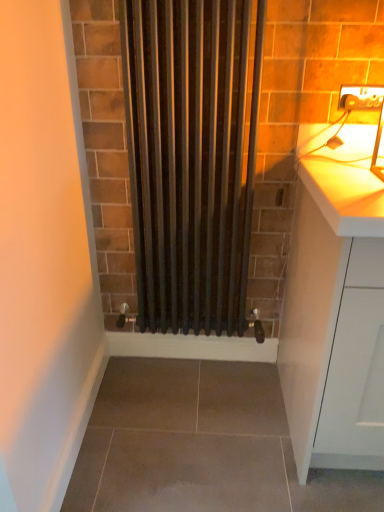
What is the approximate height of white matte cabinet at right?

The height of white matte cabinet at right is 37.88 inches.

The height and width of the screenshot is (512, 384). Describe the element at coordinates (360, 97) in the screenshot. I see `matte white electric outlet at upper right` at that location.

Locate an element on the screen. matte white electric outlet at upper right is located at coordinates (360, 97).

The image size is (384, 512). What are the coordinates of `black matte radiator at center` in the screenshot? It's located at (191, 159).

Is matte white electric outlet at upper right shorter than white matte cabinet at right?

Indeed, matte white electric outlet at upper right has a lesser height compared to white matte cabinet at right.

Is matte white electric outlet at upper right in front of or behind white matte cabinet at right in the image?

In the image, matte white electric outlet at upper right appears behind white matte cabinet at right.

Is point (369, 95) farther from viewer compared to point (298, 342)?

That is False.

In the scene shown: Considering the relative sizes of matte white electric outlet at upper right and white matte cabinet at right in the image provided, is matte white electric outlet at upper right smaller than white matte cabinet at right?

Correct, matte white electric outlet at upper right occupies less space than white matte cabinet at right.

You are a GUI agent. You are given a task and a screenshot of the screen. Output one action in this format:
    pyautogui.click(x=<x>, y=<y>)
    Task: Click on the electric outlet on the left of white matte cabinet at right
    
    Given the screenshot: What is the action you would take?
    pyautogui.click(x=360, y=97)

Who is shorter, white matte cabinet at right or matte white electric outlet at upper right?

Standing shorter between the two is matte white electric outlet at upper right.

Could you tell me if white matte cabinet at right is turned towards matte white electric outlet at upper right?

No, white matte cabinet at right is not facing towards matte white electric outlet at upper right.

Find the location of a particular element. This screenshot has height=512, width=384. shower curtain above the white matte cabinet at right (from the image's perspective) is located at coordinates (191, 159).

Which is closer, (154, 212) or (375, 384)?

The point (375, 384) is closer to the camera.

From the image's perspective, between black matte radiator at center and white matte cabinet at right, which one is located above?

Answer: black matte radiator at center is shown above in the image.

In the scene shown: Does matte white electric outlet at upper right have a larger size compared to black matte radiator at center?

Actually, matte white electric outlet at upper right might be smaller than black matte radiator at center.

Is matte white electric outlet at upper right facing towards black matte radiator at center?

No, matte white electric outlet at upper right is not turned towards black matte radiator at center.

Are matte white electric outlet at upper right and black matte radiator at center far apart?

No, matte white electric outlet at upper right is not far from black matte radiator at center.

How many degrees apart are the facing directions of matte white electric outlet at upper right and black matte radiator at center?

The facing directions of matte white electric outlet at upper right and black matte radiator at center are 0.00535 degrees apart.

From a real-world perspective, who is located higher, white matte cabinet at right or black matte radiator at center?

black matte radiator at center.

In the image, there is a white matte cabinet at right. Where is `shower curtain above it (from the image's perspective)`? shower curtain above it (from the image's perspective) is located at coordinates (x=191, y=159).

Is white matte cabinet at right oriented away from black matte radiator at center?

white matte cabinet at right does not have its back to black matte radiator at center.

Is point (377, 311) positioned behind point (234, 17)?

No, it is not.

The width and height of the screenshot is (384, 512). In order to click on electric outlet behind the black matte radiator at center in this screenshot , I will do `click(360, 97)`.

Choose the correct answer: Is black matte radiator at center inside matte white electric outlet at upper right or outside it?

black matte radiator at center is not enclosed by matte white electric outlet at upper right.

From a real-world perspective, is black matte radiator at center physically located above or below matte white electric outlet at upper right?

From a real-world perspective, black matte radiator at center is physically below matte white electric outlet at upper right.

Where is `cabinetry below the matte white electric outlet at upper right (from a real-world perspective)`? This screenshot has height=512, width=384. cabinetry below the matte white electric outlet at upper right (from a real-world perspective) is located at coordinates (x=335, y=311).

You are a GUI agent. You are given a task and a screenshot of the screen. Output one action in this format:
    pyautogui.click(x=<x>, y=<y>)
    Task: Click on the cabinetry on the right of the matte white electric outlet at upper right
    This screenshot has height=512, width=384.
    Given the screenshot: What is the action you would take?
    pyautogui.click(x=335, y=311)

From the image, which object appears to be nearer to white matte cabinet at right, matte white electric outlet at upper right or black matte radiator at center?

black matte radiator at center.

Based on the photo, considering their positions, is matte white electric outlet at upper right positioned further to black matte radiator at center than white matte cabinet at right?

matte white electric outlet at upper right.

Which object lies further to the anchor point matte white electric outlet at upper right, black matte radiator at center or white matte cabinet at right?

The object further to matte white electric outlet at upper right is white matte cabinet at right.

Looking at the image, which one is located closer to matte white electric outlet at upper right, white matte cabinet at right or black matte radiator at center?

black matte radiator at center is positioned closer to the anchor matte white electric outlet at upper right.

From the image, which object appears to be nearer to black matte radiator at center, white matte cabinet at right or matte white electric outlet at upper right?

white matte cabinet at right is closer to black matte radiator at center.

Estimate the real-world distances between objects in this image. Which object is closer to white matte cabinet at right, black matte radiator at center or matte white electric outlet at upper right?

The object closer to white matte cabinet at right is black matte radiator at center.

At what (x,y) coordinates should I click in order to perform the action: click on shower curtain between matte white electric outlet at upper right and white matte cabinet at right in the up-down direction. Please return your answer as a coordinate pair (x, y). The image size is (384, 512). Looking at the image, I should click on (191, 159).